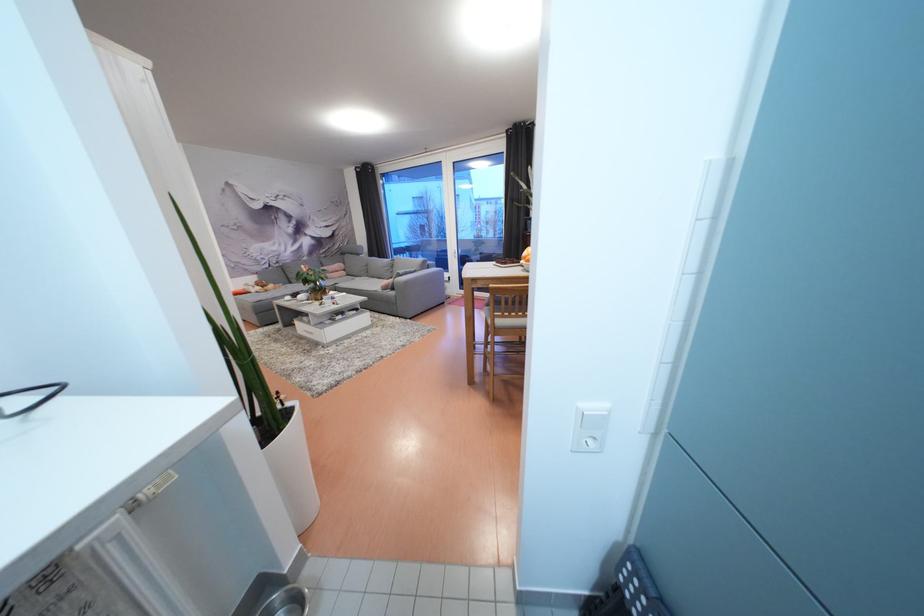
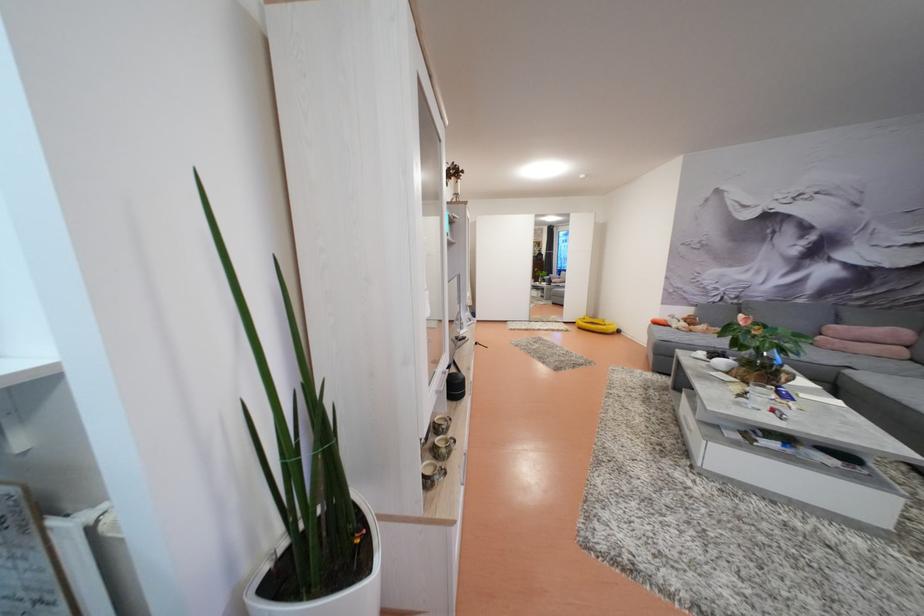
Locate, in the second image, the point that corresponds to (265,293) in the first image.

(689, 330)